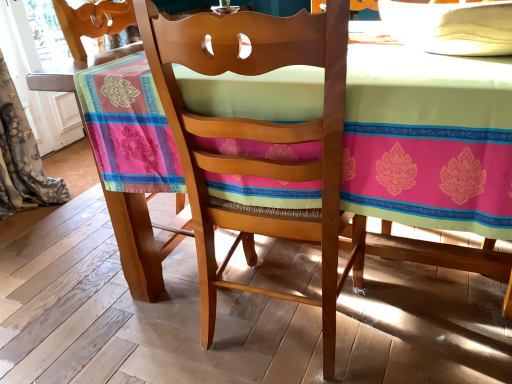
Question: From the image's perspective, would you say floral fabric curtain at left is shown under wooden chair at center?

Choices:
 (A) no
 (B) yes

Answer: (A)

Question: Can you confirm if floral fabric curtain at left is smaller than wooden chair at center?

Choices:
 (A) no
 (B) yes

Answer: (B)

Question: Can you confirm if floral fabric curtain at left is bigger than wooden chair at center?

Choices:
 (A) yes
 (B) no

Answer: (B)

Question: Considering the relative positions of floral fabric curtain at left and wooden chair at center in the image provided, is floral fabric curtain at left behind wooden chair at center?

Choices:
 (A) no
 (B) yes

Answer: (B)

Question: Is floral fabric curtain at left at the right side of wooden chair at center?

Choices:
 (A) no
 (B) yes

Answer: (A)

Question: From a real-world perspective, is floral fabric curtain at left on wooden chair at center?

Choices:
 (A) yes
 (B) no

Answer: (B)

Question: Does floral fabric curtain at left have a lesser height compared to wooden table at center?

Choices:
 (A) no
 (B) yes

Answer: (A)

Question: Does floral fabric curtain at left have a lesser width compared to wooden table at center?

Choices:
 (A) yes
 (B) no

Answer: (A)

Question: Can you confirm if floral fabric curtain at left is wider than wooden table at center?

Choices:
 (A) yes
 (B) no

Answer: (B)

Question: Is floral fabric curtain at left aimed at wooden table at center?

Choices:
 (A) no
 (B) yes

Answer: (B)

Question: Is floral fabric curtain at left further to the viewer compared to wooden table at center?

Choices:
 (A) no
 (B) yes

Answer: (B)

Question: From the image's perspective, does floral fabric curtain at left appear higher than wooden table at center?

Choices:
 (A) yes
 (B) no

Answer: (A)

Question: Does wooden chair at center appear on the right side of floral fabric curtain at left?

Choices:
 (A) yes
 (B) no

Answer: (A)